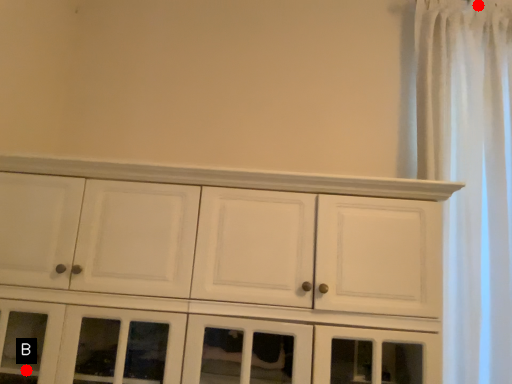
Question: Two points are circled on the image, labeled by A and B beside each circle. Which point is closer to the camera?

Choices:
 (A) A is closer
 (B) B is closer

Answer: (B)